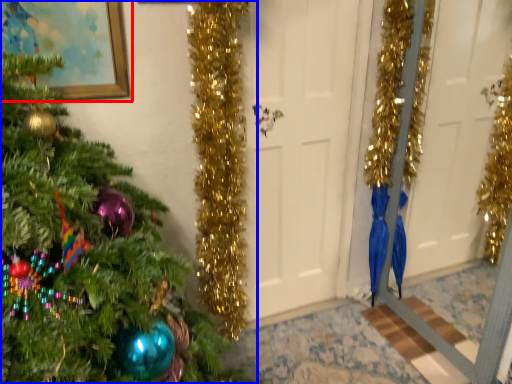
Question: Which point is closer to the camera, picture frame (highlighted by a red box) or christmas tree (highlighted by a blue box)?

Choices:
 (A) picture frame
 (B) christmas tree

Answer: (B)